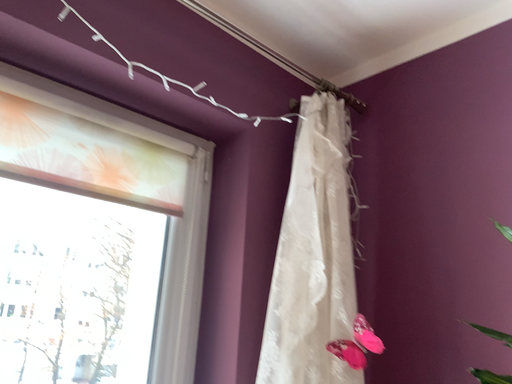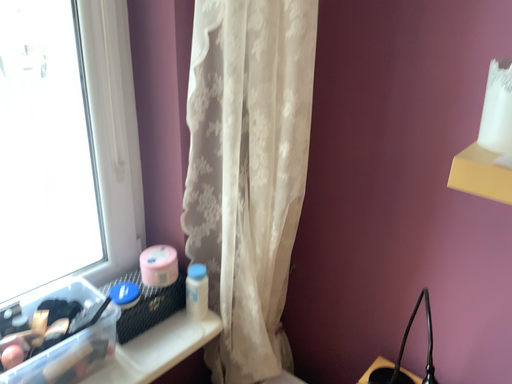
Question: How did the camera likely rotate when shooting the video?

Choices:
 (A) rotated upward
 (B) rotated downward

Answer: (B)